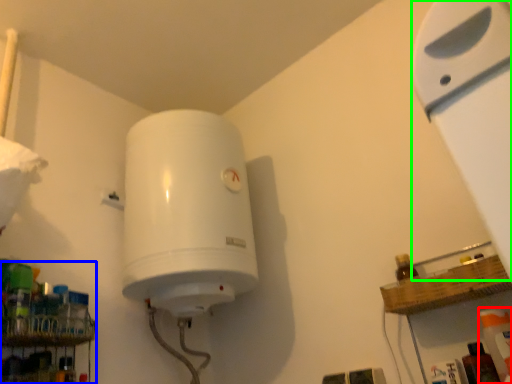
Question: Which object is positioned farthest from cleaning product (highlighted by a red box)? Select from shelf (highlighted by a blue box) and wide (highlighted by a green box).

Choices:
 (A) shelf
 (B) wide

Answer: (A)